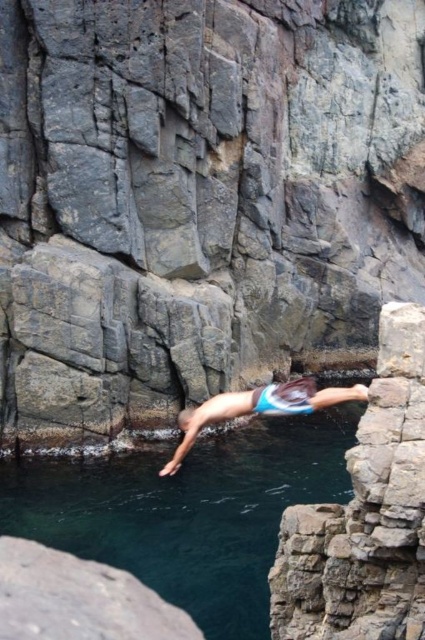
You are a photographer trying to capture the cliff jump scene. You need to ensure the clear blue water at center and blue swim trunks at center are both visible in your shot. Which object should you focus on first to ensure both are in frame?

The clear blue water at center is wider than the blue swim trunks at center, so focusing on the wider clear blue water at center first would ensure both objects are captured in the frame.

You are a safety officer assessing the safety of a cliff jump. The cliff jump area has a safety rule that the swimmer must be at least 3 meters away from the water surface to avoid injury. Based on the image, is the current distance between the blue swim trunks at center and the clear blue water at center compliant with the safety rule?

The distance between the blue swim trunks at center and the clear blue water at center is 4.02 meters, which is above the required 3 meters, so it is compliant with the safety rule.

You are a safety officer assessing the cliff jump site. The gray rock cliff at center and blue swim trunks at center are both visible from the observation point. Which object is taller?

The gray rock cliff at center is taller than the blue swim trunks at center according to the description.